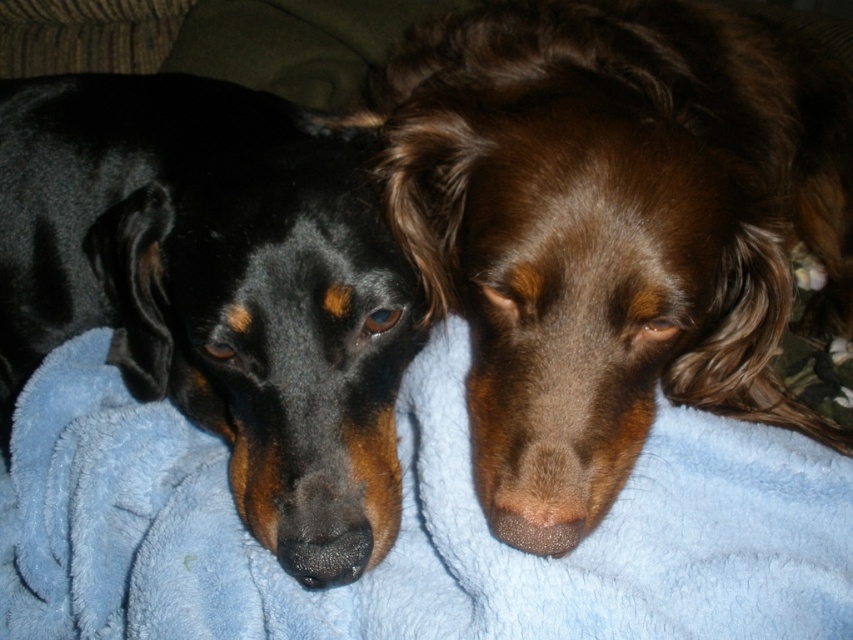
Question: Which is farther from the blue fleece blanket at center?

Choices:
 (A) black fur dog at left
 (B) brown furry dog at center

Answer: (B)

Question: Which object appears closest to the camera in this image?

Choices:
 (A) blue fleece blanket at center
 (B) brown furry dog at center
 (C) black fur dog at left

Answer: (A)

Question: Is brown furry dog at center smaller than blue fleece blanket at center?

Choices:
 (A) yes
 (B) no

Answer: (B)

Question: Among these points, which one is nearest to the camera?

Choices:
 (A) (770, 621)
 (B) (490, 298)

Answer: (A)

Question: In this image, where is brown furry dog at center located relative to black fur dog at left?

Choices:
 (A) below
 (B) above

Answer: (B)

Question: Considering the relative positions of brown furry dog at center and black fur dog at left in the image provided, where is brown furry dog at center located with respect to black fur dog at left?

Choices:
 (A) above
 (B) below

Answer: (A)